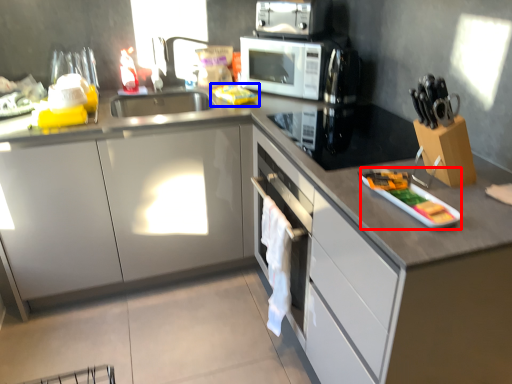
Question: Which object appears farthest to the camera in this image, appliance (highlighted by a red box) or food (highlighted by a blue box)?

Choices:
 (A) appliance
 (B) food

Answer: (B)